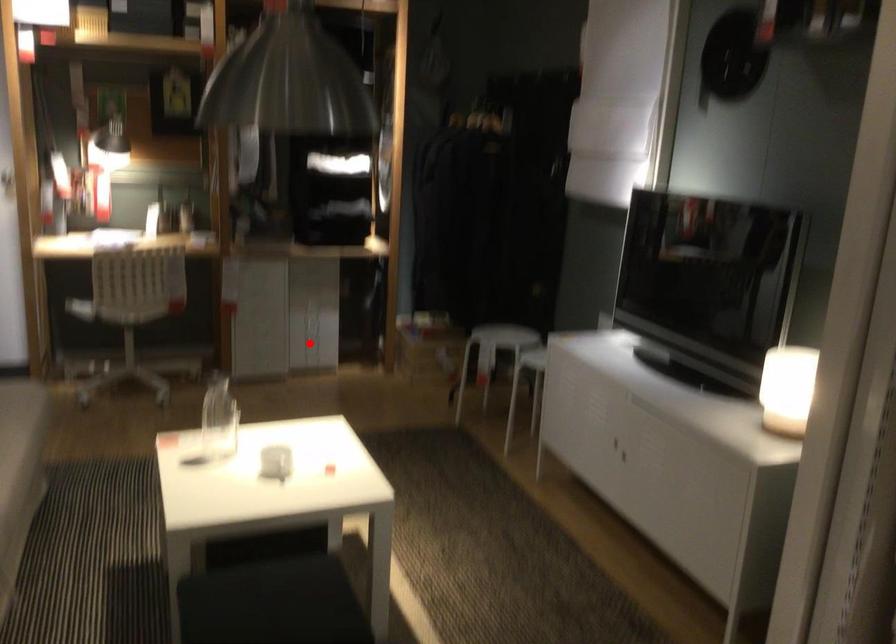
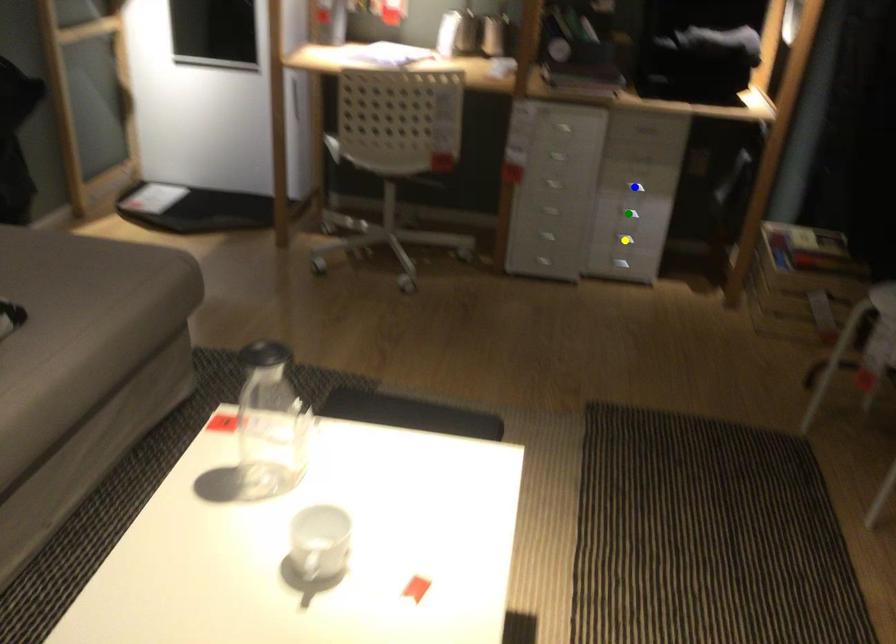
Question: I am providing you with two images of the same scene from different viewpoints. A red point is marked on the first image. You are given multiple points on the second image. Which point in image 2 is actually the same real-world point as the red point in image 1?

Choices:
 (A) yellow point
 (B) green point
 (C) blue point

Answer: (A)